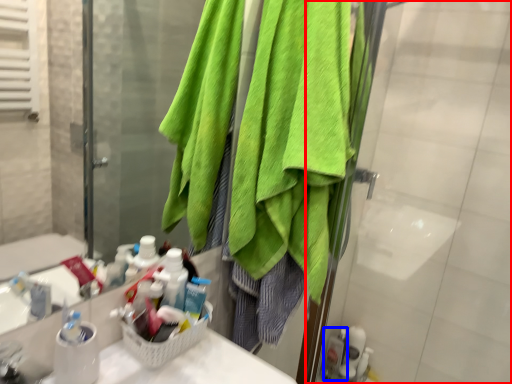
Question: Which point is closer to the camera, screen door (highlighted by a red box) or toiletry (highlighted by a blue box)?

Choices:
 (A) screen door
 (B) toiletry

Answer: (A)